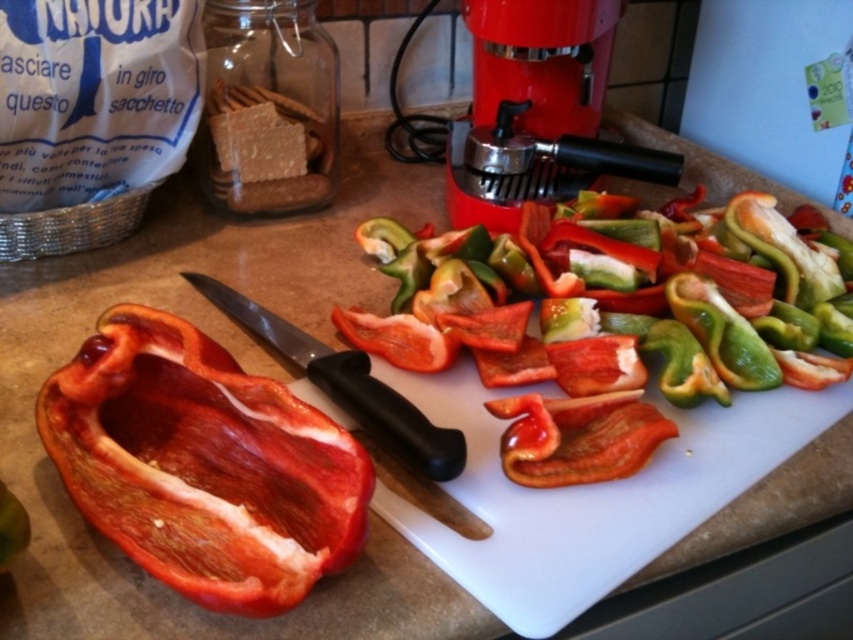
Question: Estimate the real-world distances between objects in this image. Which object is closer to the red matte bell pepper at left?

Choices:
 (A) red plastic food processor at upper center
 (B) black plastic knife at center

Answer: (B)

Question: Which object is farther from the camera taking this photo?

Choices:
 (A) black plastic knife at center
 (B) red plastic food processor at upper center
 (C) red matte bell pepper at left

Answer: (B)

Question: In this image, where is red matte bell pepper at left located relative to red plastic food processor at upper center?

Choices:
 (A) below
 (B) above

Answer: (A)

Question: In this image, where is red matte bell pepper at left located relative to red plastic food processor at upper center?

Choices:
 (A) below
 (B) above

Answer: (A)

Question: Which of the following is the closest to the observer?

Choices:
 (A) (326, 380)
 (B) (225, 368)

Answer: (B)

Question: Does red matte bell pepper at left have a greater width compared to red plastic food processor at upper center?

Choices:
 (A) yes
 (B) no

Answer: (B)